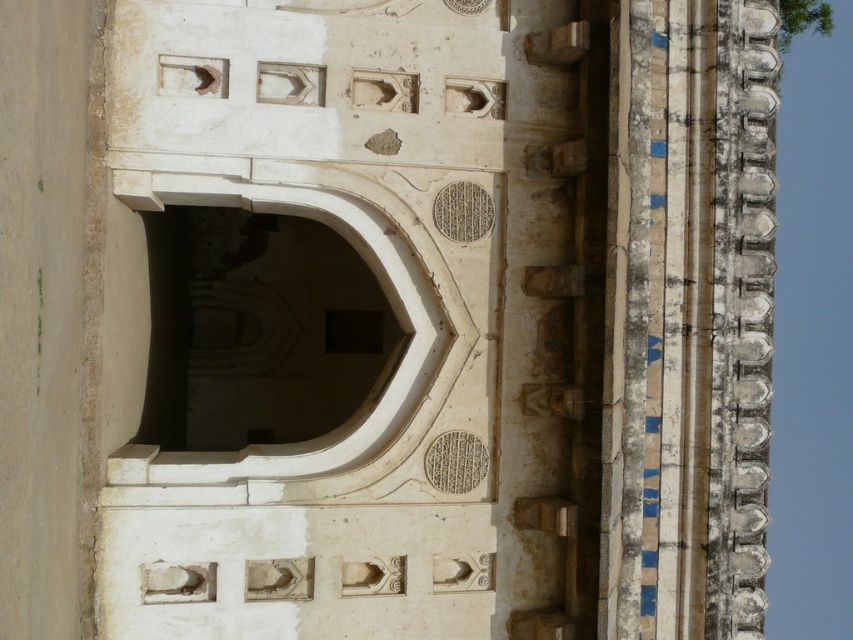
Is white stone arch at upper right in front of white stone archway at center?

Yes.

Does white stone arch at upper right appear under white stone archway at center?

Yes.

Does point (648, 355) come closer to viewer compared to point (231, 369)?

Yes, it is.

I want to click on white stone arch at upper right, so click(688, 317).